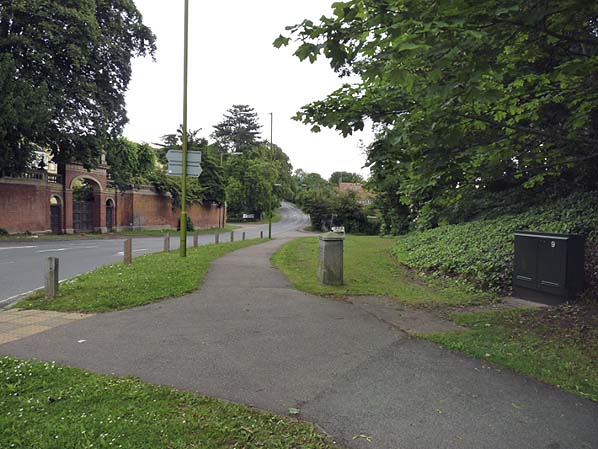
This screenshot has width=598, height=449. I want to click on arched opening, so click(x=90, y=185).